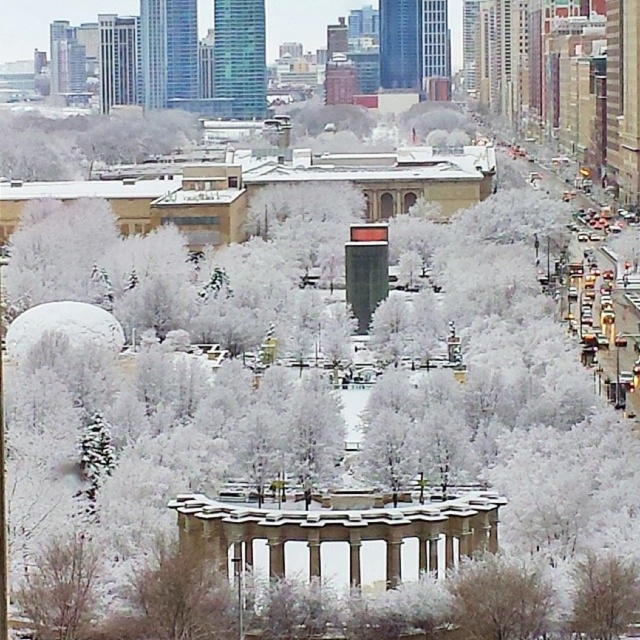
Can you confirm if white frosty tree at center is bigger than white frosty tree at lower right?

Actually, white frosty tree at center might be smaller than white frosty tree at lower right.

Who is more forward, (x=464, y=616) or (x=620, y=600)?

→ Point (x=620, y=600) is more forward.

At what (x,y) coordinates should I click in order to perform the action: click on white frosty tree at center. Please return your answer as a coordinate pair (x, y). Looking at the image, I should click on (499, 600).